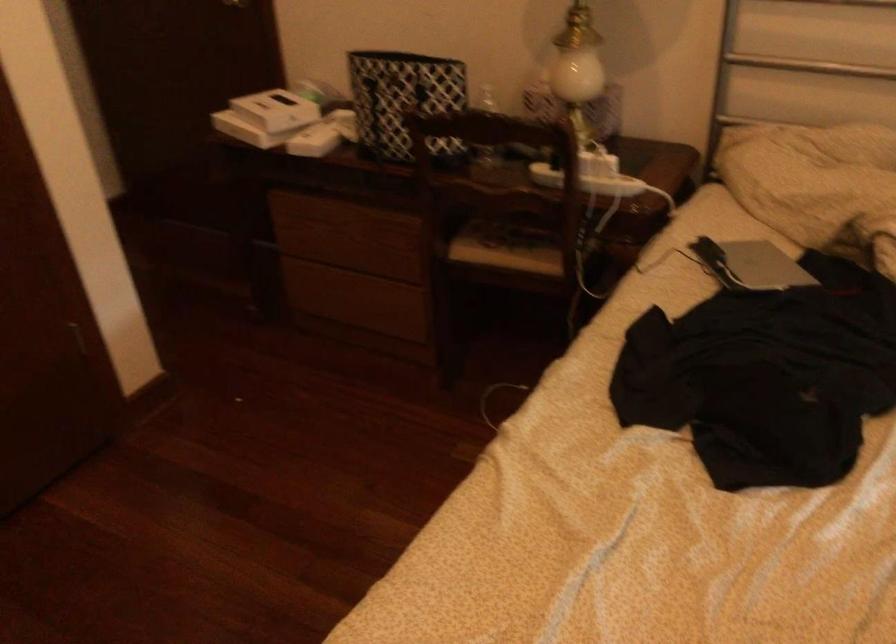
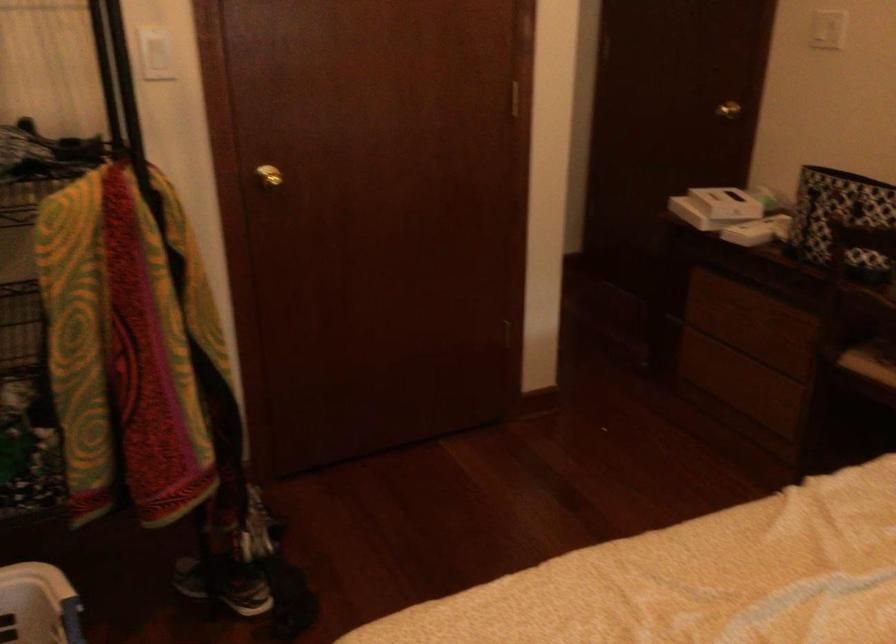
Question: I am providing you with two images of the same scene from different viewpoints. Which of the following objects are not visible in image2?

Choices:
 (A) white box
 (B) gold doorknob
 (C) white light switch
 (D) none of these

Answer: (D)